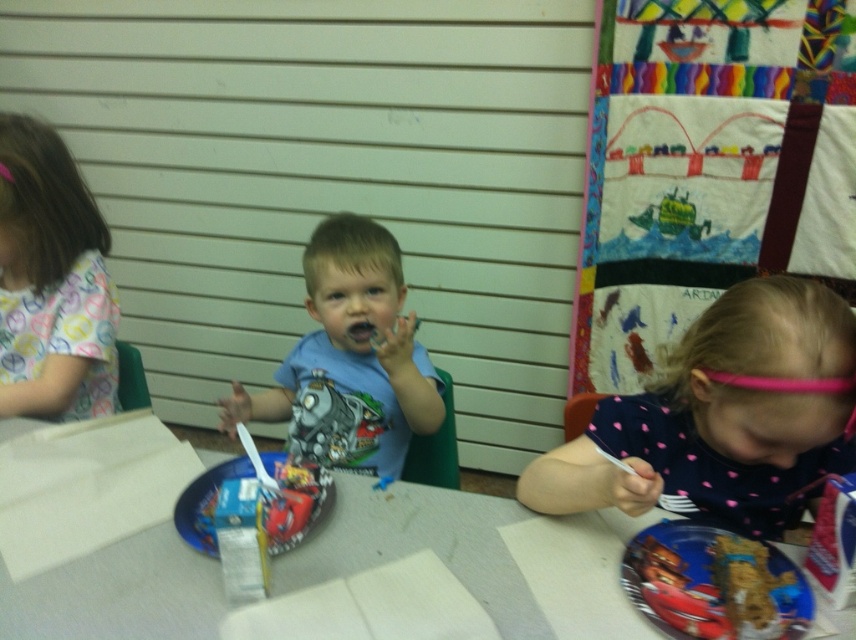
Describe the element at coordinates (349, 358) in the screenshot. I see `blue cotton shirt at center` at that location.

Which is in front, point (373, 314) or point (260, 458)?

Point (260, 458) is more forward.

Image resolution: width=856 pixels, height=640 pixels. What do you see at coordinates (349, 358) in the screenshot? I see `blue cotton shirt at center` at bounding box center [349, 358].

Where is `blue cotton shirt at center`? Image resolution: width=856 pixels, height=640 pixels. blue cotton shirt at center is located at coordinates [x=349, y=358].

Is pink dotted shirt at lower right in front of blue plastic plate at center?

Yes, pink dotted shirt at lower right is in front of blue plastic plate at center.

Identify the location of pink dotted shirt at lower right. The image size is (856, 640). (720, 419).

Who is more forward, (107, 243) or (782, 618)?

Point (782, 618) is more forward.

Does printed fabric shirt at left appear over metallic blue plate at lower right?

Yes.

Is point (88, 268) positioned before point (711, 621)?

No, (88, 268) is further to viewer.

The height and width of the screenshot is (640, 856). I want to click on printed fabric shirt at left, so click(51, 282).